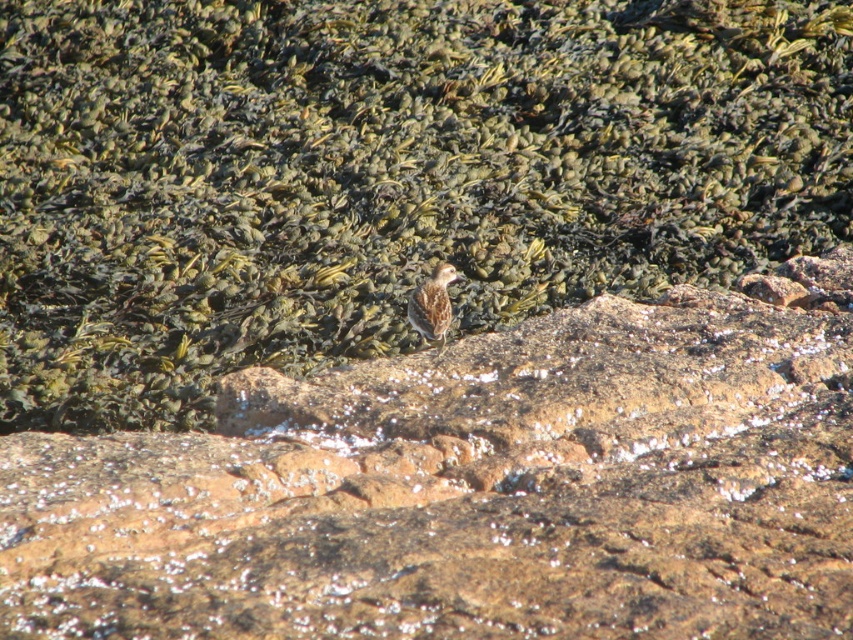
Question: Can you confirm if brown textured rock at center is thinner than brown speckled feather at center?

Choices:
 (A) no
 (B) yes

Answer: (A)

Question: Is brown textured rock at center to the right of brown rock at center from the viewer's perspective?

Choices:
 (A) no
 (B) yes

Answer: (A)

Question: Is brown textured rock at center wider than brown rock at center?

Choices:
 (A) yes
 (B) no

Answer: (B)

Question: Which object is closer to the camera taking this photo?

Choices:
 (A) brown speckled feather at center
 (B) brown textured rock at center

Answer: (A)

Question: Which point appears farthest from the camera in this image?

Choices:
 (A) pyautogui.click(x=466, y=113)
 (B) pyautogui.click(x=798, y=380)

Answer: (A)

Question: Which object is farther from the camera taking this photo?

Choices:
 (A) brown rock at center
 (B) brown textured rock at center
 (C) brown speckled feather at center

Answer: (B)